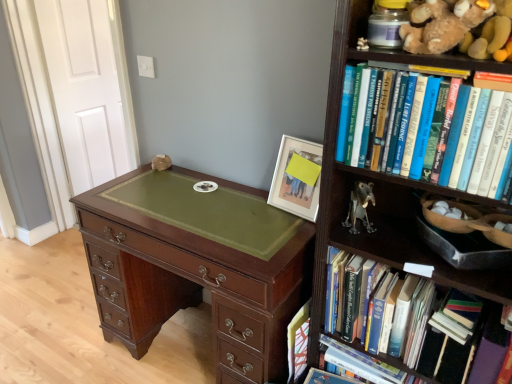
Question: From a real-world perspective, does metallic gray figurine at center-right sit lower than hardcover book at center right, placed as the first book when sorted from top to bottom?

Choices:
 (A) no
 (B) yes

Answer: (B)

Question: Is metallic gray figurine at center-right closer to camera compared to hardcover book at center right, the third book ordered from the bottom?

Choices:
 (A) yes
 (B) no

Answer: (B)

Question: Is metallic gray figurine at center-right facing away from hardcover book at center right, the third book ordered from the bottom?

Choices:
 (A) no
 (B) yes

Answer: (A)

Question: Is metallic gray figurine at center-right at the left side of hardcover book at center right, placed as the first book when sorted from top to bottom?

Choices:
 (A) no
 (B) yes

Answer: (B)

Question: Is hardcover book at center right, placed as the first book when sorted from top to bottom, a part of metallic gray figurine at center-right?

Choices:
 (A) no
 (B) yes

Answer: (A)

Question: Considering their positions, is soft brown plush at upper right located in front of or behind metallic gray figurine at center-right?

Choices:
 (A) front
 (B) behind

Answer: (A)

Question: Do you think soft brown plush at upper right is within metallic gray figurine at center-right, or outside of it?

Choices:
 (A) outside
 (B) inside

Answer: (A)

Question: From a real-world perspective, is soft brown plush at upper right positioned above or below metallic gray figurine at center-right?

Choices:
 (A) below
 (B) above

Answer: (B)

Question: From the image's perspective, is soft brown plush at upper right above or below metallic gray figurine at center-right?

Choices:
 (A) below
 (B) above

Answer: (B)

Question: From a real-world perspective, is metallic gray figurine at center-right positioned above or below hardcover book at center, the first book when ordered from bottom to top?

Choices:
 (A) below
 (B) above

Answer: (B)

Question: In the image, is metallic gray figurine at center-right on the left side or the right side of hardcover book at center, arranged as the third book when viewed from the top?

Choices:
 (A) right
 (B) left

Answer: (A)

Question: Relative to hardcover book at center, the first book when ordered from bottom to top, is metallic gray figurine at center-right in front or behind?

Choices:
 (A) behind
 (B) front

Answer: (B)

Question: Considering the positions of metallic gray figurine at center-right and hardcover book at center, the first book when ordered from bottom to top, in the image, is metallic gray figurine at center-right wider or thinner than hardcover book at center, the first book when ordered from bottom to top,?

Choices:
 (A) thin
 (B) wide

Answer: (A)

Question: Relative to matte wooden picture frame at upper center, is hardcover book at center, the first book when ordered from bottom to top, in front or behind?

Choices:
 (A) front
 (B) behind

Answer: (B)

Question: Do you think hardcover book at center, arranged as the third book when viewed from the top, is within matte wooden picture frame at upper center, or outside of it?

Choices:
 (A) outside
 (B) inside

Answer: (A)